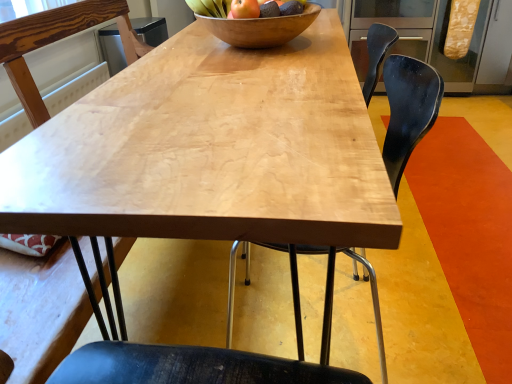
Where is `matte black chair at lower center, positioned as the first chair in left-to-right order`? matte black chair at lower center, positioned as the first chair in left-to-right order is located at coordinates (40, 310).

What do you see at coordinates (244, 9) in the screenshot? I see `matte brown apple at center` at bounding box center [244, 9].

Where is `shiny wooden bowl at upper center`? The width and height of the screenshot is (512, 384). shiny wooden bowl at upper center is located at coordinates pos(210,7).

Where is `matte black chair at lower center, which is the 3th chair from right to left`? The image size is (512, 384). matte black chair at lower center, which is the 3th chair from right to left is located at coordinates (40, 310).

Is matte brown apple at center facing away from wooden bowl at center?

matte brown apple at center is not turned away from wooden bowl at center.

From the image's perspective, is matte brown apple at center over wooden bowl at center?

No, from the image's perspective, matte brown apple at center is not on top of wooden bowl at center.

This screenshot has width=512, height=384. In order to click on apple that appears behind the wooden bowl at center in this screenshot , I will do `click(244, 9)`.

Is wooden bowl at center located within matte brown apple at center?

No, wooden bowl at center is not surrounded by matte brown apple at center.

Between matte black chair at lower center, positioned as the first chair in left-to-right order, and black matte chair at center, which is counted as the second chair, starting from the left, which one appears on the right side from the viewer's perspective?

From the viewer's perspective, black matte chair at center, which is counted as the second chair, starting from the left, appears more on the right side.

Is matte black chair at lower center, which is the 3th chair from right to left, wider or thinner than black matte chair at center, which is counted as the second chair, starting from the left?

matte black chair at lower center, which is the 3th chair from right to left, is thinner than black matte chair at center, which is counted as the second chair, starting from the left.

Is black matte chair at center, which is counted as the second chair, starting from the left, located within matte black chair at lower center, which is the 3th chair from right to left?

No, black matte chair at center, which is counted as the second chair, starting from the left, is not inside matte black chair at lower center, which is the 3th chair from right to left.

Who is bigger, black plastic chair at center, which is counted as the third chair, starting from the left, or wooden bowl at center?

black plastic chair at center, which is counted as the third chair, starting from the left, is bigger.

Is black plastic chair at center, which is counted as the third chair, starting from the left, taller than wooden bowl at center?

Correct, black plastic chair at center, which is counted as the third chair, starting from the left, is much taller as wooden bowl at center.

From the image's perspective, is black plastic chair at center, the 1th chair in the right-to-left sequence, positioned above or below wooden bowl at center?

From the image's perspective, black plastic chair at center, the 1th chair in the right-to-left sequence, appears below wooden bowl at center.

Which is in front, point (399, 93) or point (83, 294)?

The point (83, 294) is in front.

Consider the image. Considering the sizes of black plastic chair at center, which is counted as the third chair, starting from the left, and matte black chair at lower center, positioned as the first chair in left-to-right order, in the image, is black plastic chair at center, which is counted as the third chair, starting from the left, bigger or smaller than matte black chair at lower center, positioned as the first chair in left-to-right order,?

Clearly, black plastic chair at center, which is counted as the third chair, starting from the left, is smaller in size than matte black chair at lower center, positioned as the first chair in left-to-right order.

Looking at this image, is black plastic chair at center, the 1th chair in the right-to-left sequence, inside or outside of matte black chair at lower center, positioned as the first chair in left-to-right order?

black plastic chair at center, the 1th chair in the right-to-left sequence, is outside matte black chair at lower center, positioned as the first chair in left-to-right order.

Which is more to the right, wooden bowl at center or matte black chair at lower center, which is the 3th chair from right to left?

From the viewer's perspective, wooden bowl at center appears more on the right side.

Is wooden bowl at center oriented away from matte black chair at lower center, which is the 3th chair from right to left?

Yes, wooden bowl at center's orientation is away from matte black chair at lower center, which is the 3th chair from right to left.

Is point (298, 32) positioned in front of point (36, 284)?

No, (298, 32) is behind (36, 284).

Is wooden bowl at center taller or shorter than matte black chair at lower center, which is the 3th chair from right to left?

wooden bowl at center is shorter than matte black chair at lower center, which is the 3th chair from right to left.

Who is bigger, matte black chair at lower center, positioned as the first chair in left-to-right order, or wooden bowl at center?

matte black chair at lower center, positioned as the first chair in left-to-right order, is bigger.

Between point (45, 267) and point (252, 25), which one is positioned in front?

The point (45, 267) is in front.

Based on their positions, is matte black chair at lower center, which is the 3th chair from right to left, located to the left or right of wooden bowl at center?

matte black chair at lower center, which is the 3th chair from right to left, is positioned on wooden bowl at center's left side.

Is black plastic chair at center, the 1th chair in the right-to-left sequence, inside or outside of shiny wooden bowl at upper center?

The correct answer is: outside.

Measure the distance between black plastic chair at center, the 1th chair in the right-to-left sequence, and shiny wooden bowl at upper center.

The distance of black plastic chair at center, the 1th chair in the right-to-left sequence, from shiny wooden bowl at upper center is 21.58 inches.

Based on their positions, is black plastic chair at center, the 1th chair in the right-to-left sequence, located to the left or right of shiny wooden bowl at upper center?

black plastic chair at center, the 1th chair in the right-to-left sequence, is positioned on shiny wooden bowl at upper center's right side.

Which is farther from the camera, (411, 142) or (201, 11)?

The point (201, 11) is farther from the camera.

The image size is (512, 384). Find the location of `bowl located in front of the matte brown apple at center`. bowl located in front of the matte brown apple at center is located at coordinates (260, 28).

Locate an element on the screen. chair that is on the left side of black matte chair at center, which is counted as the second chair, starting from the left is located at coordinates (40, 310).

Looking at the image, which one is located further to matte brown apple at center, wooden bowl at center or black matte chair at center, placed as the 2th chair when sorted from right to left?

black matte chair at center, placed as the 2th chair when sorted from right to left.

Considering their positions, is wooden bowl at center positioned closer to matte brown apple at center than matte black chair at lower center, positioned as the first chair in left-to-right order?

Among the two, wooden bowl at center is located nearer to matte brown apple at center.

Based on their spatial positions, is black plastic chair at center, which is counted as the third chair, starting from the left, or shiny wooden bowl at upper center further from black matte chair at center, placed as the 2th chair when sorted from right to left?

The object further to black matte chair at center, placed as the 2th chair when sorted from right to left, is shiny wooden bowl at upper center.

Estimate the real-world distances between objects in this image. Which object is closer to black matte chair at center, which is counted as the second chair, starting from the left, black plastic chair at center, which is counted as the third chair, starting from the left, or matte brown apple at center?

black plastic chair at center, which is counted as the third chair, starting from the left, is closer to black matte chair at center, which is counted as the second chair, starting from the left.

Estimate the real-world distances between objects in this image. Which object is further from matte brown apple at center, matte black chair at lower center, which is the 3th chair from right to left, or black plastic chair at center, the 1th chair in the right-to-left sequence?

matte black chair at lower center, which is the 3th chair from right to left, is positioned further to the anchor matte brown apple at center.

Based on the photo, looking at the image, which one is located closer to wooden bowl at center, matte black chair at lower center, positioned as the first chair in left-to-right order, or black matte chair at center, which is counted as the second chair, starting from the left?

black matte chair at center, which is counted as the second chair, starting from the left.

When comparing their distances from matte brown apple at center, does black plastic chair at center, the 1th chair in the right-to-left sequence, or wooden bowl at center seem closer?

Based on the image, wooden bowl at center appears to be nearer to matte brown apple at center.

Which object lies nearer to the anchor point matte brown apple at center, black matte chair at center, placed as the 2th chair when sorted from right to left, or wooden bowl at center?

The object closer to matte brown apple at center is wooden bowl at center.

Find the location of `chair positioned between black matte chair at center, placed as the 2th chair when sorted from right to left, and matte brown apple at center from near to far`. chair positioned between black matte chair at center, placed as the 2th chair when sorted from right to left, and matte brown apple at center from near to far is located at coordinates (408, 110).

The width and height of the screenshot is (512, 384). What are the coordinates of `bowl positioned between matte black chair at lower center, positioned as the first chair in left-to-right order, and matte brown apple at center from near to far` in the screenshot? It's located at (260, 28).

Locate an element on the screen. This screenshot has height=384, width=512. bowl between shiny wooden bowl at upper center and black plastic chair at center, the 1th chair in the right-to-left sequence, in the up-down direction is located at coordinates (260, 28).

Where is `apple between wooden bowl at center and black plastic chair at center, which is counted as the third chair, starting from the left, in the up-down direction`? apple between wooden bowl at center and black plastic chair at center, which is counted as the third chair, starting from the left, in the up-down direction is located at coordinates (244, 9).